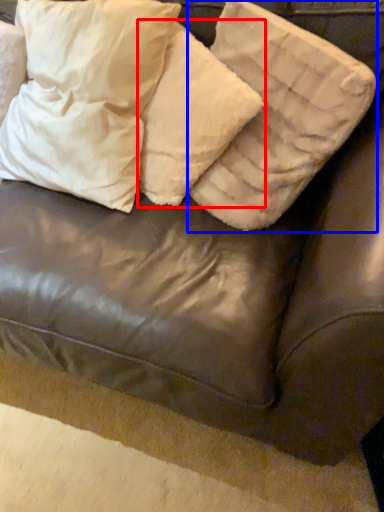
Question: Which point is closer to the camera, pillow (highlighted by a red box) or pillow (highlighted by a blue box)?

Choices:
 (A) pillow
 (B) pillow

Answer: (B)